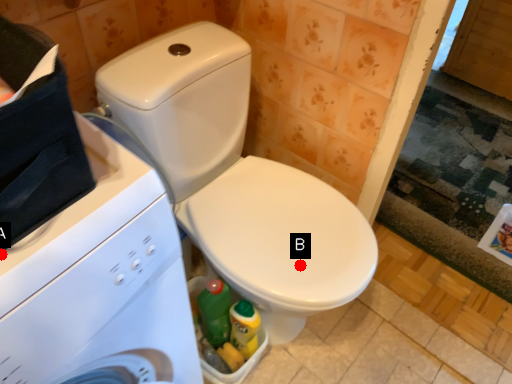
Question: Two points are circled on the image, labeled by A and B beside each circle. Among these points, which one is nearest to the camera?

Choices:
 (A) A is closer
 (B) B is closer

Answer: (A)